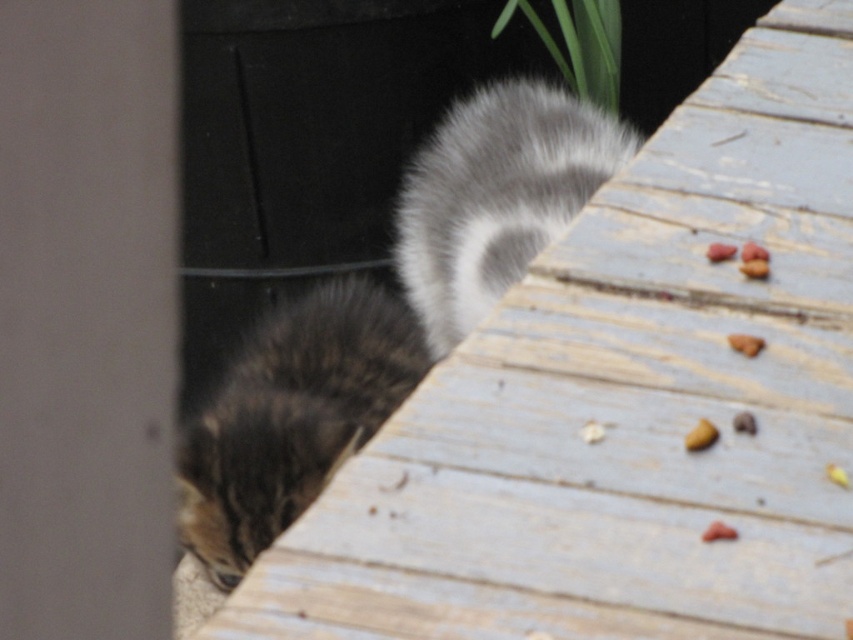
Question: Which object is positioned closest to the fuzzy fur tail at upper right?

Choices:
 (A) yellow matte food at lower right
 (B) tabby fur cat at lower left
 (C) brown crumbly food at right
 (D) green leafy plant at upper center

Answer: (D)

Question: Which of the following is the closest to the observer?

Choices:
 (A) (589, 26)
 (B) (517, 102)
 (C) (351, 291)

Answer: (C)

Question: Considering the relative positions of green leafy plant at upper center and yellow matte food at lower right in the image provided, where is green leafy plant at upper center located with respect to yellow matte food at lower right?

Choices:
 (A) below
 (B) above

Answer: (B)

Question: Considering the relative positions of fuzzy fur tail at upper right and green leafy plant at upper center in the image provided, where is fuzzy fur tail at upper right located with respect to green leafy plant at upper center?

Choices:
 (A) below
 (B) above

Answer: (A)

Question: Does tabby fur cat at lower left appear under green leafy plant at upper center?

Choices:
 (A) yes
 (B) no

Answer: (A)

Question: Which of the following is the closest to the observer?

Choices:
 (A) (727, 250)
 (B) (570, 129)

Answer: (A)